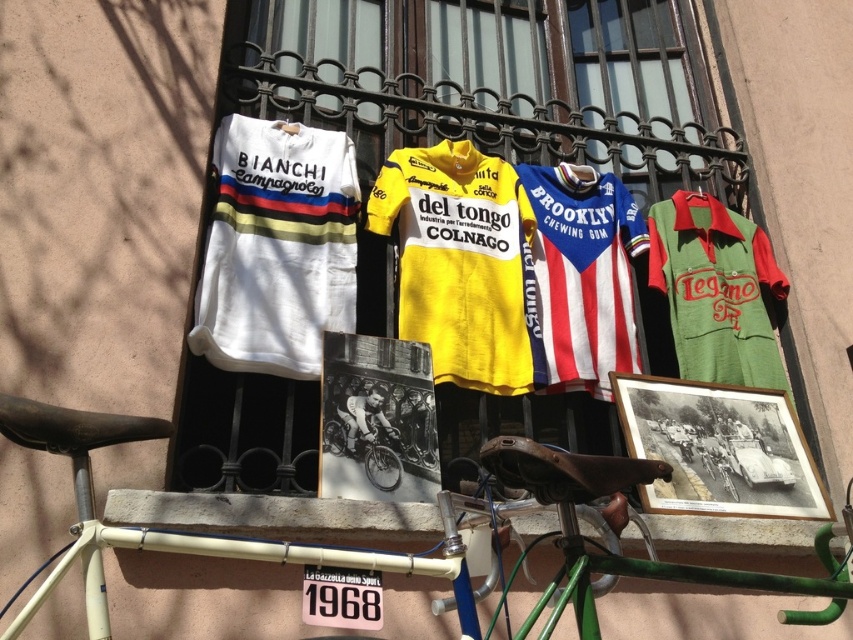
You are a tailor measuring the yellow jersey at center and the green jersey at right for alterations. Which jersey requires a wider fabric piece for adjustments?

The yellow jersey at center requires a wider fabric piece for adjustments because its width is larger than the green jersey at right.

Consider the image. You are a tailor measuring the height of the white jersey at left and the yellow jersey at center displayed on a balcony railing. Which jersey is shorter in height?

The white jersey at left is not as tall as the yellow jersey at center, so the white jersey at left is shorter.

You are standing on the balcony and want to hang a new cycling jersey between the green jersey at right and the white jersey with BIANCHI Campagnolo. Is there enough space between them?

The green jersey at right is positioned at point (715, 291), but without knowing the position of the white jersey with BIANCHI Campagnolo, it is impossible to determine if there is enough space between them.